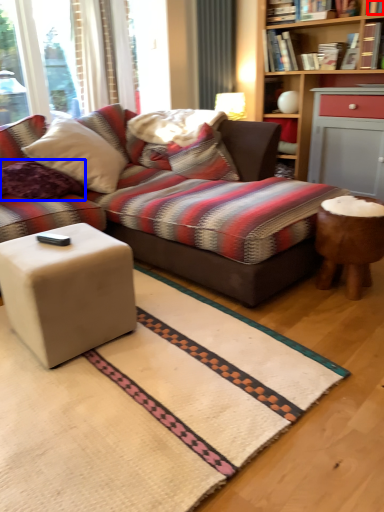
Question: Among these objects, which one is farthest to the camera, book (highlighted by a red box) or pillow (highlighted by a blue box)?

Choices:
 (A) book
 (B) pillow

Answer: (A)